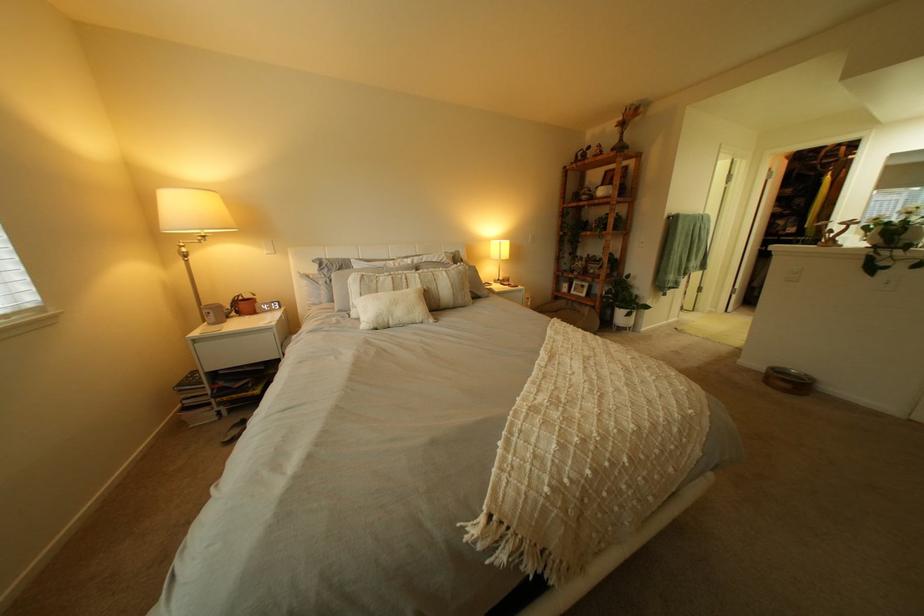
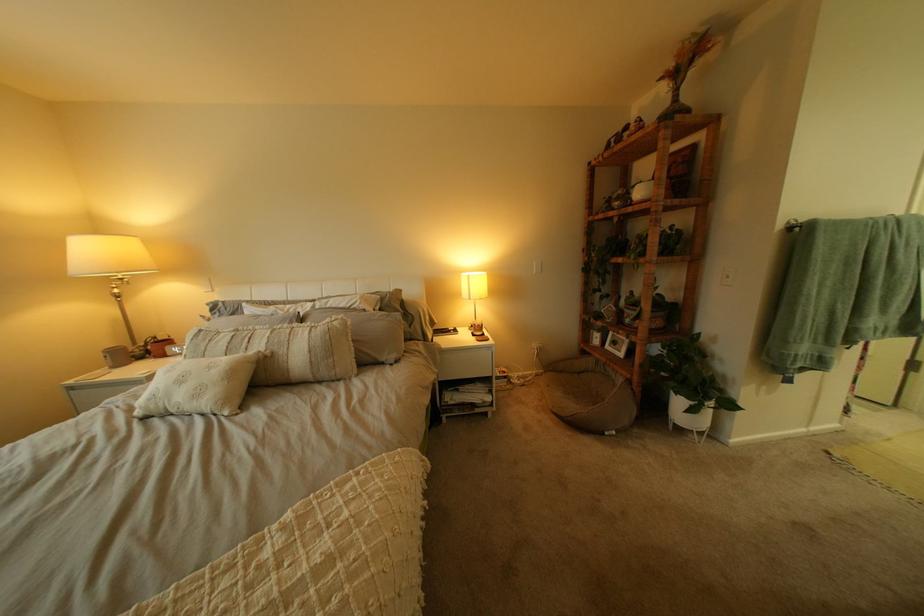
Locate, in the second image, the point that corresponds to point (631, 128) in the first image.

(675, 81)